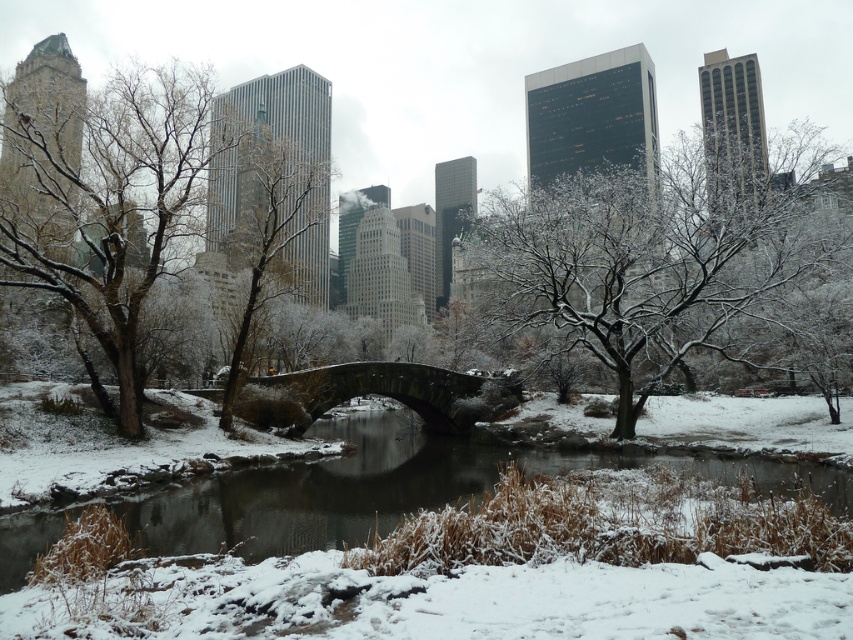
The width and height of the screenshot is (853, 640). Describe the element at coordinates (648, 268) in the screenshot. I see `white frosty tree at center` at that location.

Where is `white frosty tree at center`? Image resolution: width=853 pixels, height=640 pixels. white frosty tree at center is located at coordinates (648, 268).

Which is below, snow-covered tree at center or dark gray stone bridge at center?

dark gray stone bridge at center is below.

Between snow-covered tree at center and dark gray stone bridge at center, which one appears on the right side from the viewer's perspective?

From the viewer's perspective, dark gray stone bridge at center appears more on the right side.

Is point (299, 291) positioned after point (260, 376)?

That is True.

Locate an element on the screen. The image size is (853, 640). snow-covered tree at center is located at coordinates (x=273, y=221).

Is snow-covered tree at left bigger than snow-covered tree at center?

Actually, snow-covered tree at left might be smaller than snow-covered tree at center.

Is snow-covered tree at left wider than snow-covered tree at center?

No, snow-covered tree at left is not wider than snow-covered tree at center.

Is point (103, 227) positioned after point (310, 285)?

No, (103, 227) is in front of (310, 285).

Where is `snow-covered tree at left`? snow-covered tree at left is located at coordinates (108, 202).